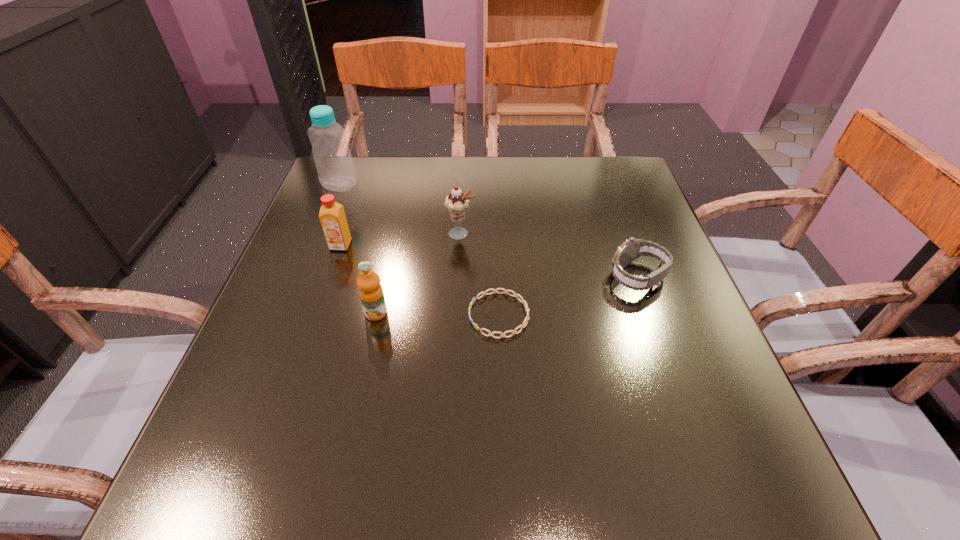
The width and height of the screenshot is (960, 540). What are the coordinates of `vacant space situated on the left of the icecream` in the screenshot? It's located at (394, 234).

At what (x,y) coordinates should I click in order to perform the action: click on vacant region located 0.120m on the front and back of the farther orange juice. Please return your answer as a coordinate pair (x, y). This screenshot has width=960, height=540. Looking at the image, I should click on (325, 292).

This screenshot has width=960, height=540. Identify the location of blank space located 0.260m on the label of the right orange juice. (345, 459).

Identify the location of vacant space located on the face of the rightmost object. (442, 277).

Locate an element on the screen. The width and height of the screenshot is (960, 540). free spot located 0.100m on the face of the rightmost object is located at coordinates (562, 277).

Find the location of a particular element. This screenshot has height=540, width=960. free spot located 0.090m on the face of the rightmost object is located at coordinates (566, 277).

Identify the location of blank area located 0.190m on the surface of the shortest object showing star-shaped elements. The width and height of the screenshot is (960, 540). (370, 315).

Where is `vacant region located on the surface of the shortest object showing star-shaped elements`? This screenshot has width=960, height=540. vacant region located on the surface of the shortest object showing star-shaped elements is located at coordinates (400, 315).

Find the location of a particular element. The width and height of the screenshot is (960, 540). free region located 0.360m on the surface of the shortest object showing star-shaped elements is located at coordinates (280, 315).

Where is `object at the far edge`? The image size is (960, 540). object at the far edge is located at coordinates (334, 163).